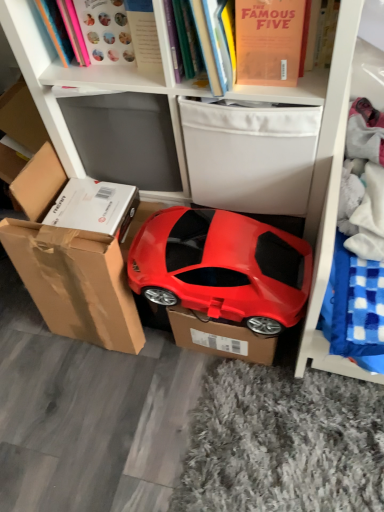
Question: Visually, is hardcover book at upper center, the 2th book in the left-to-right sequence, positioned to the left or to the right of matte orange book at upper center, which is the 3th book from left to right?

Choices:
 (A) right
 (B) left

Answer: (B)

Question: Considering the positions of hardcover book at upper center, the 2th book in the left-to-right sequence, and matte orange book at upper center, the 1th book positioned from the right, in the image, is hardcover book at upper center, the 2th book in the left-to-right sequence, bigger or smaller than matte orange book at upper center, the 1th book positioned from the right,?

Choices:
 (A) big
 (B) small

Answer: (B)

Question: Which of these objects is positioned closest to the glossy plastic car at center?

Choices:
 (A) matte pink book at upper left, the 1th book when ordered from left to right
 (B) hardcover book at upper center, the 2th book in the left-to-right sequence
 (C) matte orange book at upper center, which is the 3th book from left to right
 (D) brown cardboard box at lower left
 (E) white fabric storage box at upper center

Answer: (E)

Question: Estimate the real-world distances between objects in this image. Which object is farther from the brown cardboard box at lower left?

Choices:
 (A) white fabric storage box at upper center
 (B) matte orange book at upper center, the 1th book positioned from the right
 (C) matte pink book at upper left, which appears as the third book when viewed from the right
 (D) hardcover book at upper center, the 2th book in the left-to-right sequence
 (E) glossy plastic car at center

Answer: (C)